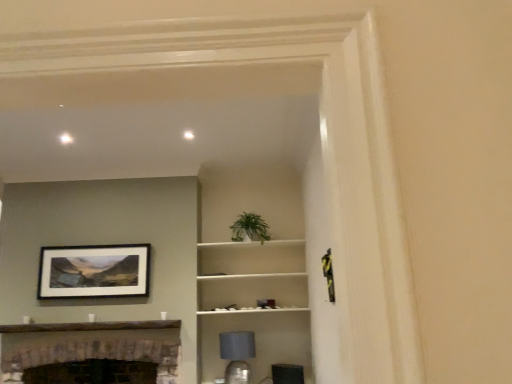
What is the approximate width of white matte shelf at center?

white matte shelf at center is 14.04 inches wide.

The width and height of the screenshot is (512, 384). What do you see at coordinates (250, 228) in the screenshot?
I see `green leafy plant at center` at bounding box center [250, 228].

The height and width of the screenshot is (384, 512). Describe the element at coordinates (91, 353) in the screenshot. I see `brick fireplace at lower left` at that location.

What is the approximate height of matte gray lampshade at lower center?

19.56 inches.

Image resolution: width=512 pixels, height=384 pixels. Find the location of `white matte shelf at center`. white matte shelf at center is located at coordinates (252, 290).

You are a GUI agent. You are given a task and a screenshot of the screen. Output one action in this format:
    pyautogui.click(x=<x>, y=<y>)
    Task: Click on the lamp below the green leafy plant at center (from the image's perspective)
    This screenshot has height=384, width=512.
    Given the screenshot: What is the action you would take?
    pyautogui.click(x=237, y=355)

Is point (243, 367) positioned behind point (253, 235)?

No, (243, 367) is closer to viewer.

Is green leafy plant at center completely or partially inside matte gray lampshade at lower center?

No, green leafy plant at center is located outside of matte gray lampshade at lower center.

What's the angular difference between matte gray lampshade at lower center and green leafy plant at center's facing directions?

4.65 degrees.

Which is nearer, (72, 338) or (207, 284)?

The point (72, 338) is in front.

Considering their positions, is brick fireplace at lower left located in front of or behind white matte shelf at center?

In the image, brick fireplace at lower left appears in front of white matte shelf at center.

Is brick fireplace at lower left taller than white matte shelf at center?

No, brick fireplace at lower left is not taller than white matte shelf at center.

Considering the sizes of green leafy plant at center and matte gray lampshade at lower center in the image, is green leafy plant at center wider or thinner than matte gray lampshade at lower center?

In the image, green leafy plant at center appears to be wider than matte gray lampshade at lower center.

From the image's perspective, is green leafy plant at center located above matte gray lampshade at lower center?

Correct, green leafy plant at center appears higher than matte gray lampshade at lower center in the image.

Is green leafy plant at center looking in the opposite direction of matte gray lampshade at lower center?

No, green leafy plant at center is not facing away from matte gray lampshade at lower center.

Is brick fireplace at lower left to the right of green leafy plant at center from the viewer's perspective?

Incorrect, brick fireplace at lower left is not on the right side of green leafy plant at center.

In the scene shown: Considering the sizes of objects brick fireplace at lower left and green leafy plant at center in the image provided, who is wider, brick fireplace at lower left or green leafy plant at center?

brick fireplace at lower left is wider.

Is brick fireplace at lower left not close to green leafy plant at center?

brick fireplace at lower left is positioned a significant distance from green leafy plant at center.

Are matte gray lampshade at lower center and matte black picture frame at upper left beside each other?

No, matte gray lampshade at lower center is not making contact with matte black picture frame at upper left.

Does point (244, 347) appear closer or farther from the camera than point (139, 283)?

Clearly, point (244, 347) is closer to the camera than point (139, 283).

From the picture: Which object is positioned more to the left, matte gray lampshade at lower center or matte black picture frame at upper left?

matte black picture frame at upper left is more to the left.

Does matte gray lampshade at lower center have a greater height compared to matte black picture frame at upper left?

No, matte gray lampshade at lower center is not taller than matte black picture frame at upper left.

Does point (62, 262) come closer to viewer compared to point (224, 345)?

That is False.

Is matte gray lampshade at lower center surrounded by matte black picture frame at upper left?

Definitely not — matte gray lampshade at lower center is not inside matte black picture frame at upper left.

From the image's perspective, would you say matte black picture frame at upper left is shown under matte gray lampshade at lower center?

No, from the image's perspective, matte black picture frame at upper left is not beneath matte gray lampshade at lower center.

How far apart are matte black picture frame at upper left and matte gray lampshade at lower center?

matte black picture frame at upper left is 4.19 feet away from matte gray lampshade at lower center.

Is green leafy plant at center at the left side of white matte shelf at center?

Yes.

Is green leafy plant at center bigger or smaller than white matte shelf at center?

green leafy plant at center is smaller than white matte shelf at center.

Considering the points (252, 221) and (243, 292), which point is behind, point (252, 221) or point (243, 292)?

The point (243, 292) is more distant.

In order to click on plant positioned vertically above the matte gray lampshade at lower center (from a real-world perspective) in this screenshot , I will do `click(250, 228)`.

I want to click on fireplace that appears in front of the white matte shelf at center, so click(x=91, y=353).

Considering their positions, is white matte shelf at center positioned closer to brick fireplace at lower left than matte gray lampshade at lower center?

white matte shelf at center.

Considering their positions, is matte black picture frame at upper left positioned closer to matte gray lampshade at lower center than white matte shelf at center?

white matte shelf at center is closer to matte gray lampshade at lower center.

From the picture: Considering their positions, is matte gray lampshade at lower center positioned further to white matte shelf at center than green leafy plant at center?

green leafy plant at center.

Which object lies further to the anchor point green leafy plant at center, matte gray lampshade at lower center or brick fireplace at lower left?

brick fireplace at lower left is further to green leafy plant at center.

When comparing their distances from white matte shelf at center, does matte black picture frame at upper left or matte gray lampshade at lower center seem closer?

matte gray lampshade at lower center lies closer to white matte shelf at center than the other object.

When comparing their distances from brick fireplace at lower left, does matte black picture frame at upper left or white matte shelf at center seem closer?

matte black picture frame at upper left.

Looking at the image, which one is located closer to brick fireplace at lower left, white matte shelf at center or matte black picture frame at upper left?

matte black picture frame at upper left is closer to brick fireplace at lower left.

When comparing their distances from matte gray lampshade at lower center, does white matte shelf at center or brick fireplace at lower left seem further?

brick fireplace at lower left is further to matte gray lampshade at lower center.

Image resolution: width=512 pixels, height=384 pixels. Find the location of `lamp located between brick fireplace at lower left and green leafy plant at center in the left-right direction`. lamp located between brick fireplace at lower left and green leafy plant at center in the left-right direction is located at coordinates (237, 355).

Find the location of a particular element. fireplace situated between matte black picture frame at upper left and matte gray lampshade at lower center from left to right is located at coordinates (91, 353).

At what (x,y) coordinates should I click in order to perform the action: click on fireplace between matte black picture frame at upper left and green leafy plant at center in the horizontal direction. Please return your answer as a coordinate pair (x, y). Looking at the image, I should click on (91, 353).

Identify the location of fireplace between matte black picture frame at upper left and white matte shelf at center in the horizontal direction. (91, 353).